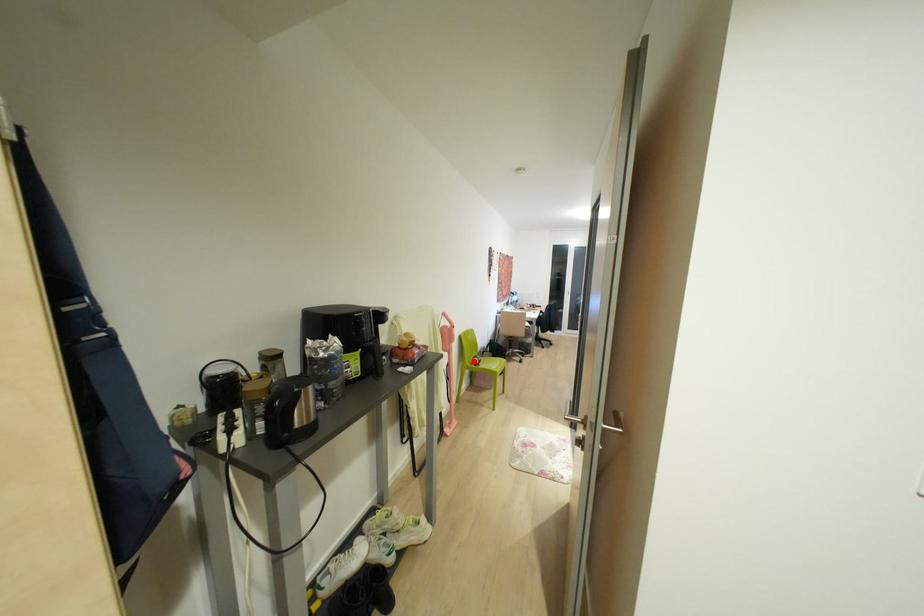
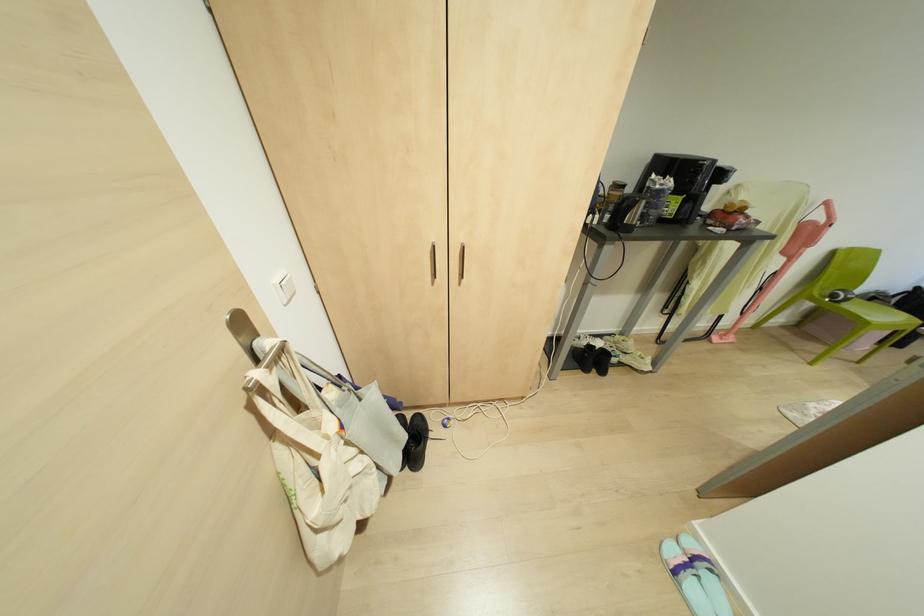
Question: I am providing you with two images of the same scene from different viewpoints. In image1, a red point is highlighted. Considering the same 3D point in image2, which of the following is correct?

Choices:
 (A) It is closer
 (B) It is farther

Answer: (A)